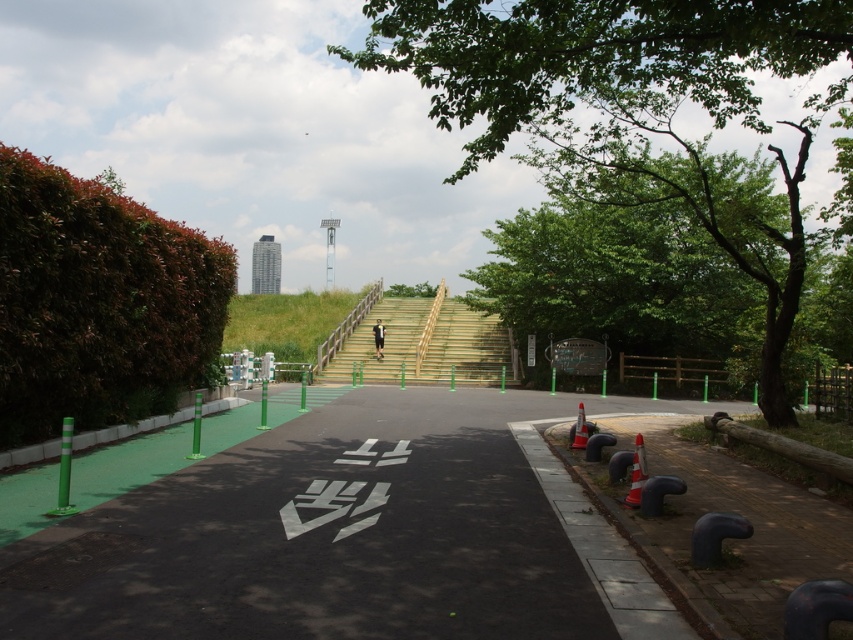
Is wooden stairs at center positioned in front of orange cone at center?

No, wooden stairs at center is behind orange cone at center.

Between wooden stairs at center and orange cone at center, which one is positioned lower?

orange cone at center is below.

This screenshot has height=640, width=853. Identify the location of wooden stairs at center. [426, 342].

Between green leafy tree at center and green leafy tree at upper center, which one has less height?

green leafy tree at upper center

Is green leafy tree at center thinner than green leafy tree at upper center?

No.

Who is more distant from viewer, (653, 36) or (451, 81)?

The point (451, 81) is more distant.

The height and width of the screenshot is (640, 853). Identify the location of green leafy tree at center. (631, 109).

Looking at this image, does black asphalt path at center have a greater height compared to green leafy tree at upper center?

In fact, black asphalt path at center may be shorter than green leafy tree at upper center.

Who is taller, black asphalt path at center or green leafy tree at upper center?

Standing taller between the two is green leafy tree at upper center.

Does point (167, 506) come closer to viewer compared to point (795, 49)?

Yes, it is.

Image resolution: width=853 pixels, height=640 pixels. In order to click on black asphalt path at center in this screenshot , I will do `click(329, 534)`.